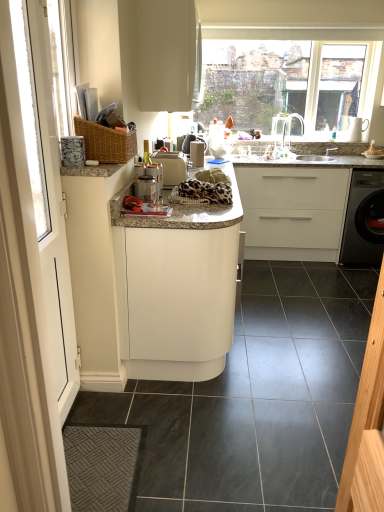
Question: Does point (175, 36) appear closer or farther from the camera than point (170, 223)?

Choices:
 (A) closer
 (B) farther

Answer: (B)

Question: From a real-world perspective, relative to white matte cabinet at center, the 1th cabinetry ordered from the bottom, is white matte cabinet at upper center, the 1th cabinetry from the top, vertically above or below?

Choices:
 (A) above
 (B) below

Answer: (A)

Question: Which object is the farthest from the satin silver coffee machine at center?

Choices:
 (A) beige plastic toaster at center, the second appliance when ordered from top to bottom
 (B) black glossy washing machine at right
 (C) granite countertop at center
 (D) clear glass window at upper right
 (E) leopard print fabric at center

Answer: (D)

Question: Which object is positioned farthest from the satin silver coffee machine at center?

Choices:
 (A) clear glass window at upper right
 (B) white matte cabinet at center, marked as the 3th cabinetry in a top-to-bottom arrangement
 (C) granite countertop at center
 (D) woven wood basket at upper left
 (E) white matte cabinet at center, positioned as the 2th cabinetry in bottom-to-top order

Answer: (A)